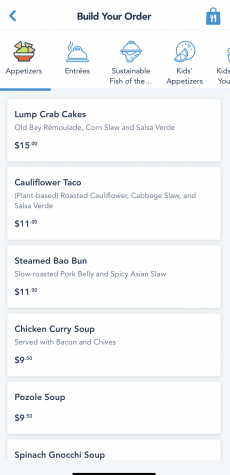
Locate an element on the screen. platter is located at coordinates 78,54.